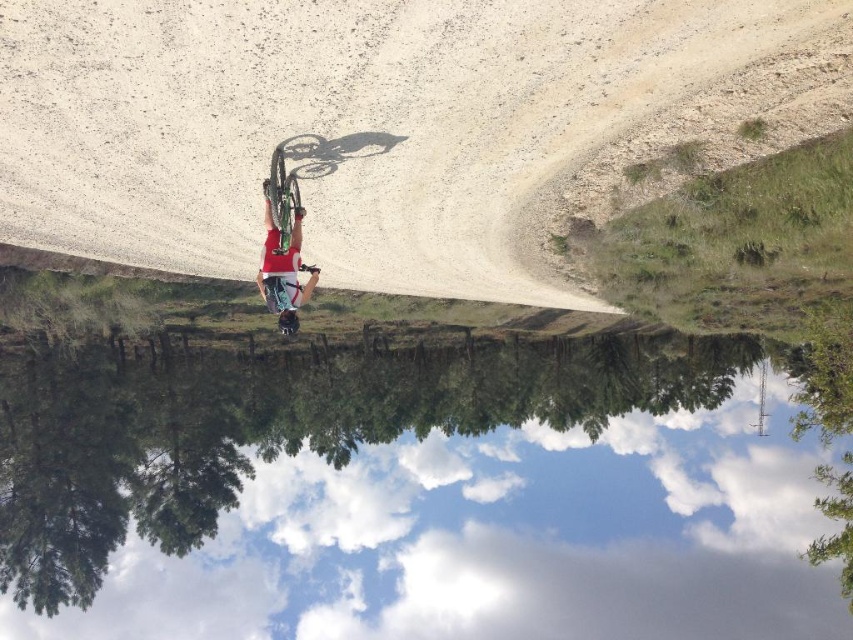
Question: Which point is farther to the camera?

Choices:
 (A) transparent glass lake at center
 (B) green matte bicycle at center

Answer: (A)

Question: Is transparent glass lake at center below green matte bicycle at center?

Choices:
 (A) yes
 (B) no

Answer: (A)

Question: Does transparent glass lake at center lie behind green matte bicycle at center?

Choices:
 (A) yes
 (B) no

Answer: (A)

Question: Is brown gravel dirt track at upper center positioned before green matte bicycle at center?

Choices:
 (A) yes
 (B) no

Answer: (A)

Question: Estimate the real-world distances between objects in this image. Which object is farther from the green matte bicycle at center?

Choices:
 (A) transparent glass lake at center
 (B) brown gravel dirt track at upper center

Answer: (A)

Question: Which is nearer to the brown gravel dirt track at upper center?

Choices:
 (A) transparent glass lake at center
 (B) green matte bicycle at center

Answer: (B)